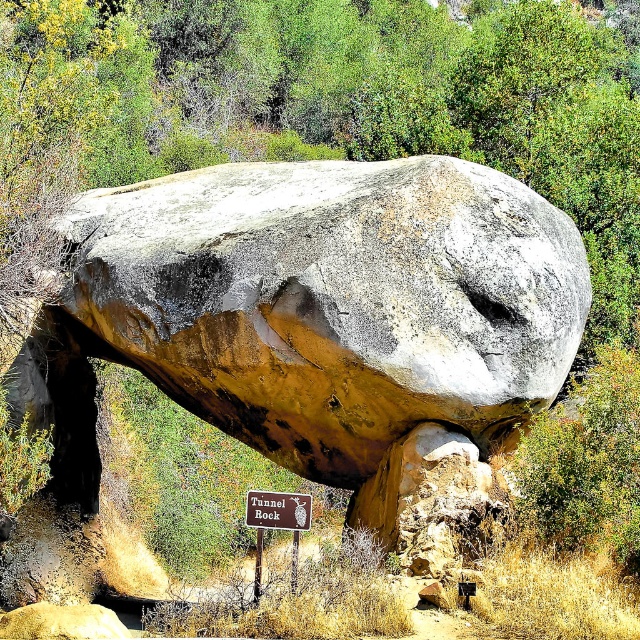
From the picture: Which of these two, gray/rough rock at center or brown wooden sign at center, stands taller?

Standing taller between the two is gray/rough rock at center.

In the scene shown: Can you confirm if gray/rough rock at center is taller than brown wooden sign at center?

Indeed, gray/rough rock at center has a greater height compared to brown wooden sign at center.

Does point (77, 314) come farther from viewer compared to point (308, 513)?

Yes, point (77, 314) is behind point (308, 513).

I want to click on gray/rough rock at center, so click(310, 308).